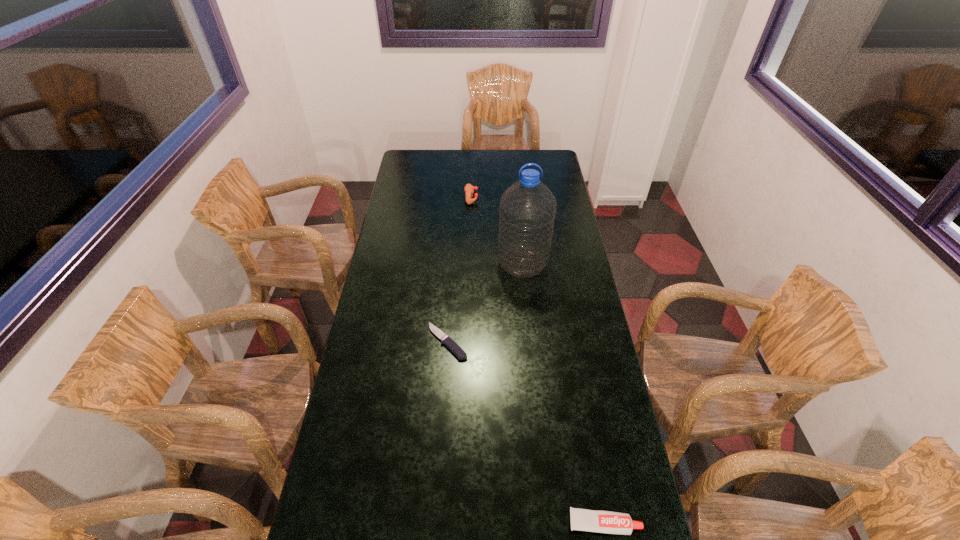
Identify the location of vacant space located 0.150m on the left of the third tallest object. (511, 523).

Find the location of a particular element. The image size is (960, 540). free space located on the back of the second nearest object is located at coordinates (449, 313).

Where is `water jug at the right edge`? water jug at the right edge is located at coordinates (527, 209).

Locate an element on the screen. toothpaste situated at the right edge is located at coordinates (608, 522).

The height and width of the screenshot is (540, 960). Find the location of `vacant area at the far edge of the desktop`. vacant area at the far edge of the desktop is located at coordinates (455, 150).

Locate an element on the screen. vacant space at the left edge of the desktop is located at coordinates (406, 281).

The image size is (960, 540). What are the coordinates of `vacant region at the right edge of the desktop` in the screenshot? It's located at (572, 236).

The image size is (960, 540). Identify the location of vacant space at the far right corner of the desktop. (540, 162).

Locate an element on the screen. vacant area that lies between the farthest object and the second shortest object is located at coordinates (538, 360).

Find the location of a particular element. Image resolution: width=960 pixels, height=540 pixels. free spot between the water jug and the third tallest object is located at coordinates (564, 393).